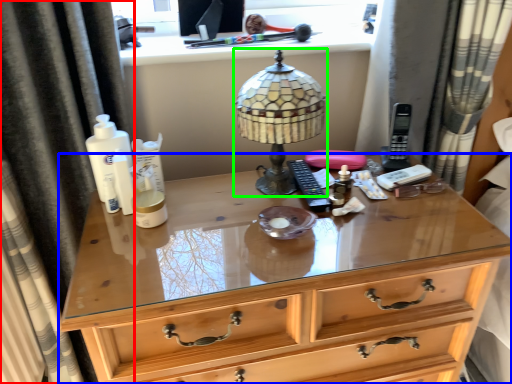
Question: Estimate the real-world distances between objects in this image. Which object is farther from curtain (highlighted by a red box), chest of drawers (highlighted by a blue box) or lamp (highlighted by a green box)?

Choices:
 (A) chest of drawers
 (B) lamp

Answer: (B)